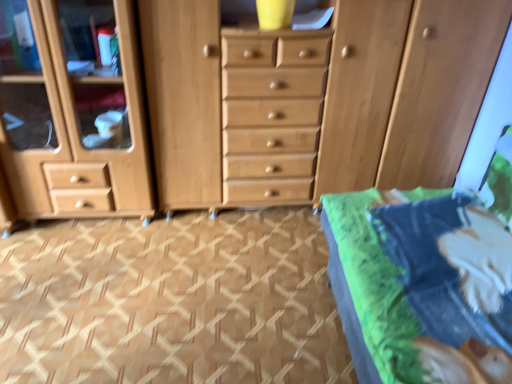
Question: From the image's perspective, would you say brown textured carpet at center is positioned over green fabric bed at lower right?

Choices:
 (A) yes
 (B) no

Answer: (B)

Question: From a real-world perspective, is brown textured carpet at center over green fabric bed at lower right?

Choices:
 (A) yes
 (B) no

Answer: (B)

Question: Can you confirm if brown textured carpet at center is wider than green fabric bed at lower right?

Choices:
 (A) no
 (B) yes

Answer: (B)

Question: Can you confirm if brown textured carpet at center is shorter than green fabric bed at lower right?

Choices:
 (A) no
 (B) yes

Answer: (B)

Question: Is brown textured carpet at center completely or partially outside of green fabric bed at lower right?

Choices:
 (A) yes
 (B) no

Answer: (A)

Question: Does brown textured carpet at center have a lesser width compared to green fabric bed at lower right?

Choices:
 (A) yes
 (B) no

Answer: (B)

Question: Is brown textured carpet at center smaller than light brown wood chest of drawers at center?

Choices:
 (A) yes
 (B) no

Answer: (A)

Question: Considering the relative sizes of brown textured carpet at center and light brown wood chest of drawers at center in the image provided, is brown textured carpet at center bigger than light brown wood chest of drawers at center?

Choices:
 (A) no
 (B) yes

Answer: (A)

Question: Is brown textured carpet at center not inside light brown wood chest of drawers at center?

Choices:
 (A) no
 (B) yes

Answer: (B)

Question: From a real-world perspective, does brown textured carpet at center sit lower than light brown wood chest of drawers at center?

Choices:
 (A) no
 (B) yes

Answer: (B)

Question: From the image's perspective, is brown textured carpet at center on top of light brown wood chest of drawers at center?

Choices:
 (A) yes
 (B) no

Answer: (B)

Question: Are brown textured carpet at center and light brown wood chest of drawers at center beside each other?

Choices:
 (A) no
 (B) yes

Answer: (A)

Question: Is green fabric bed at lower right not inside brown textured carpet at center?

Choices:
 (A) no
 (B) yes

Answer: (B)